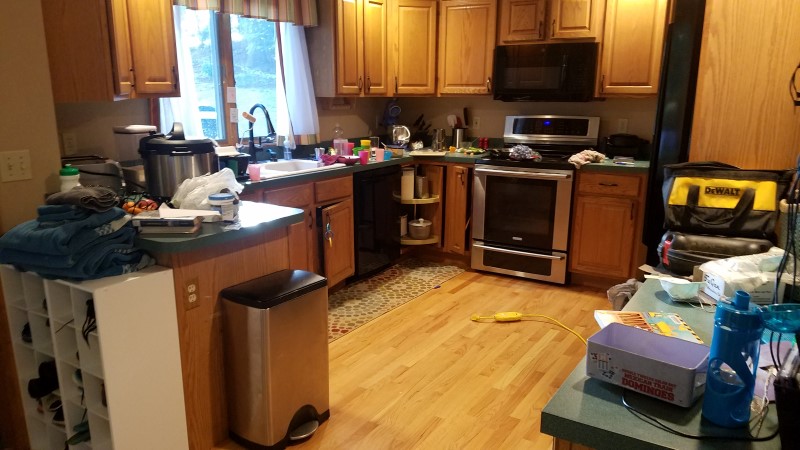
Where is `light switch`? light switch is located at coordinates (16, 169).